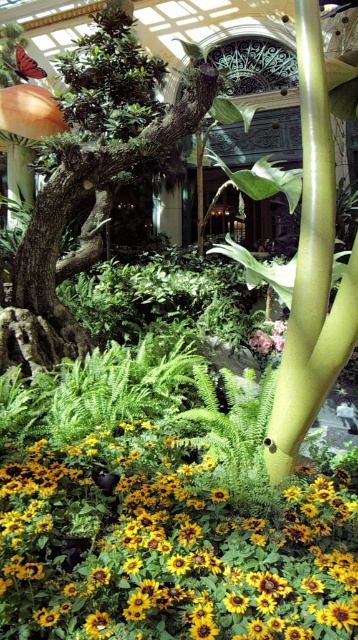
Does green textured tree at center appear over pink matte flower at center?

Yes, green textured tree at center is above pink matte flower at center.

Does green textured tree at center come behind pink matte flower at center?

No, green textured tree at center is closer to the viewer.

The width and height of the screenshot is (358, 640). What do you see at coordinates (93, 179) in the screenshot? I see `green textured tree at center` at bounding box center [93, 179].

This screenshot has width=358, height=640. Identify the location of green textured tree at center. (93, 179).

Between yellow matte flower at center and pink matte flower at center, which one is positioned lower?

yellow matte flower at center is below.

Which is in front, point (112, 449) or point (268, 332)?

Point (112, 449)

Find the location of a particular element. The height and width of the screenshot is (640, 358). yellow matte flower at center is located at coordinates (167, 552).

Which is more to the left, yellow matte flower at center or green textured tree at center?

yellow matte flower at center

Who is lower down, yellow matte flower at center or green textured tree at center?

yellow matte flower at center is lower down.

Which is behind, point (194, 605) or point (92, 58)?

The point (92, 58) is more distant.

The width and height of the screenshot is (358, 640). I want to click on yellow matte flower at center, so click(x=167, y=552).